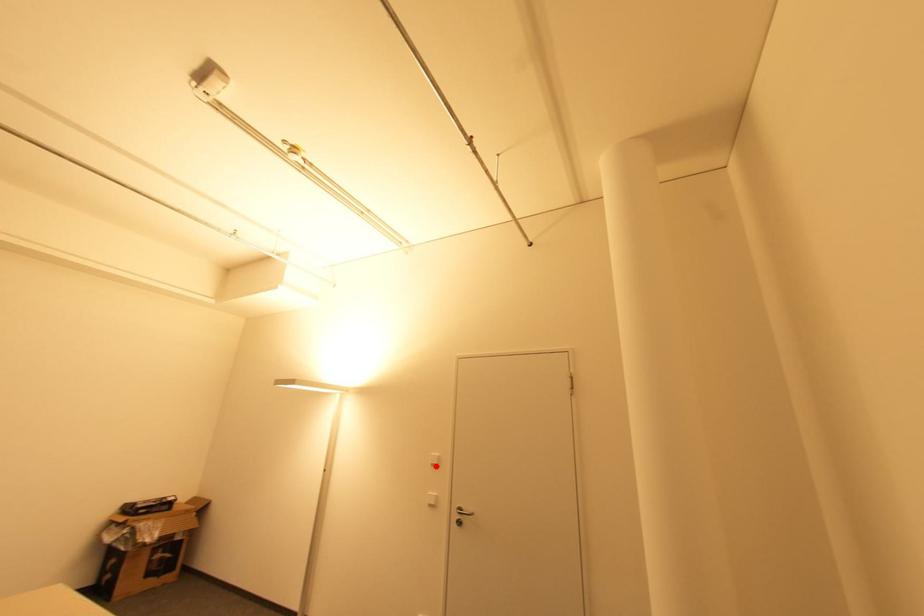
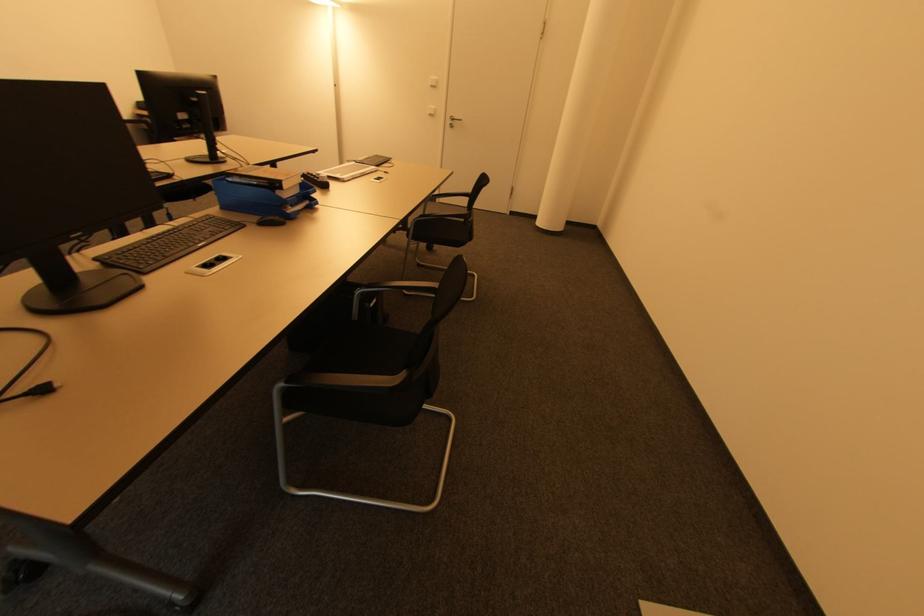
Find the pixel in the second image that matches the highlighted location in the first image.

(434, 87)